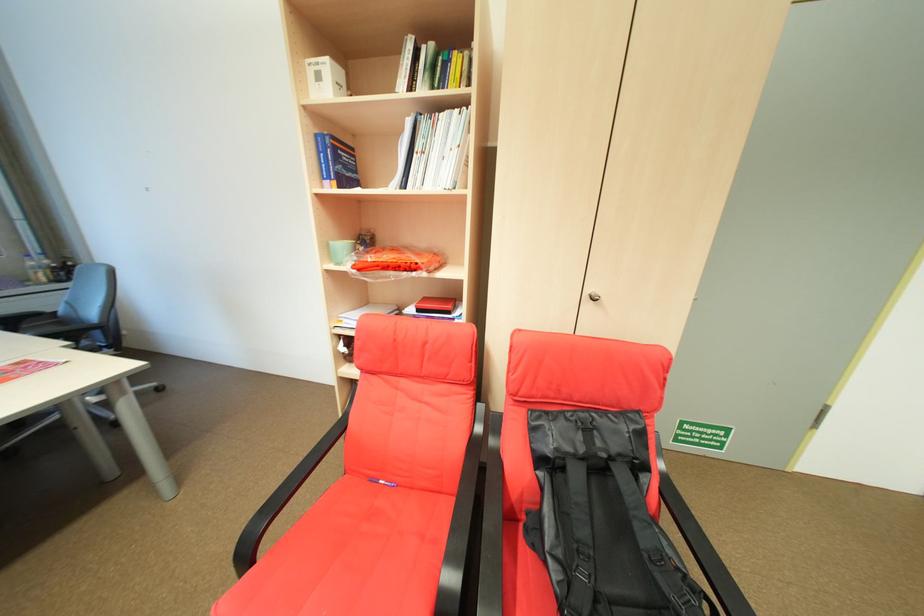
Where is `red chair sitting surface`? This screenshot has width=924, height=616. red chair sitting surface is located at coordinates (361, 554).